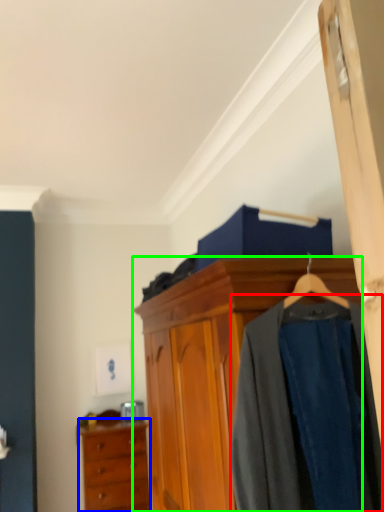
Question: Which is nearer to the clothing (highlighted by a red box)? chest of drawers (highlighted by a blue box) or cabinetry (highlighted by a green box).

Choices:
 (A) chest of drawers
 (B) cabinetry

Answer: (B)